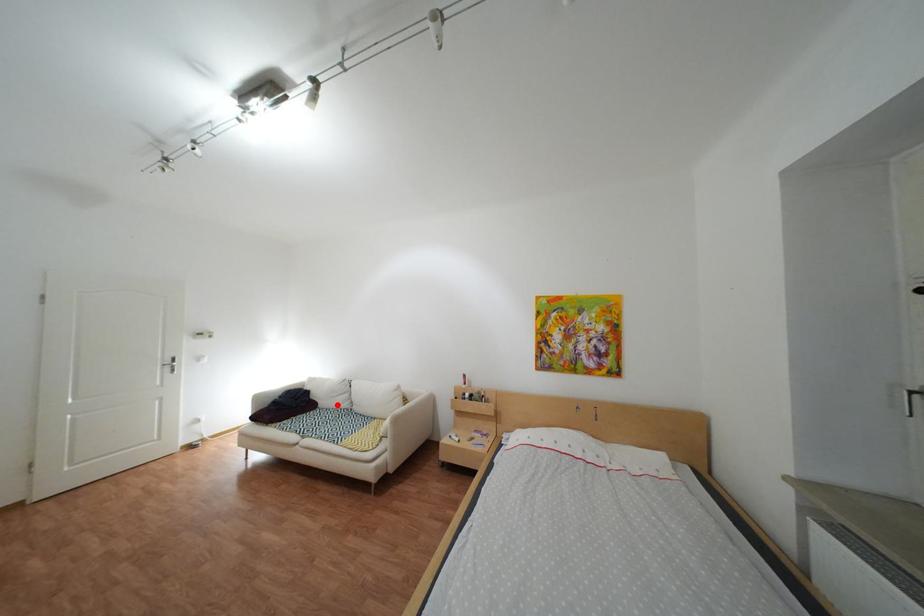
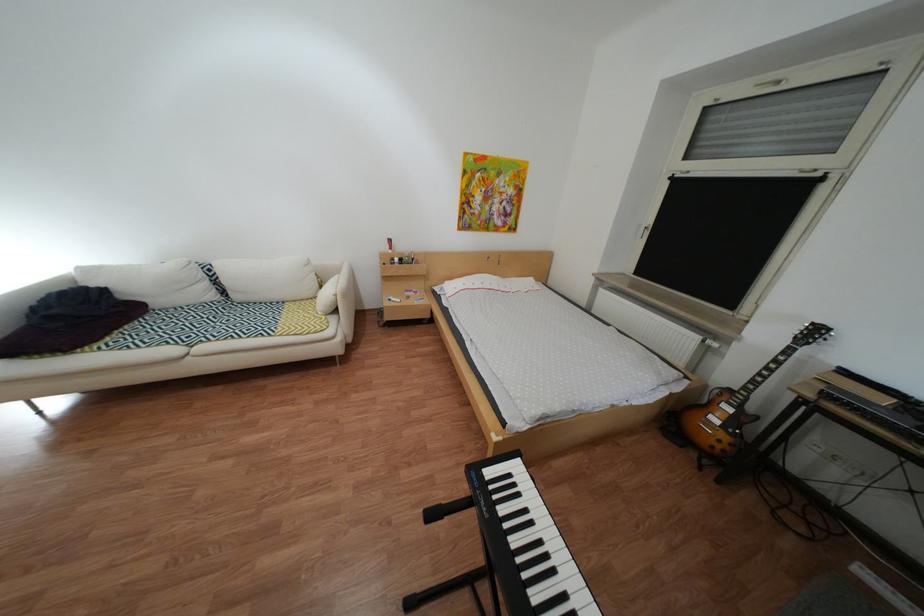
Question: I am providing you with two images of the same scene from different viewpoints. A red point is shown in image1. For the corresponding object point in image2, is it positioned nearer or farther from the camera?

Choices:
 (A) Nearer
 (B) Farther

Answer: (A)